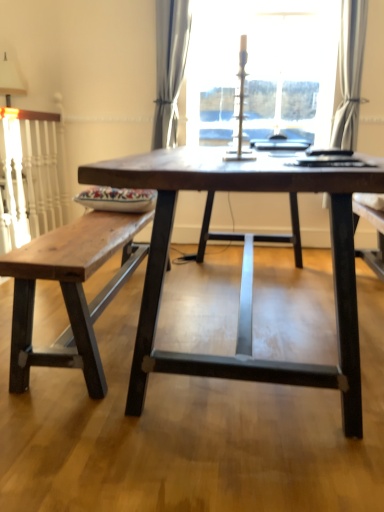
I want to click on free spot below dark wood table at center (from a real-world perspective), so click(241, 332).